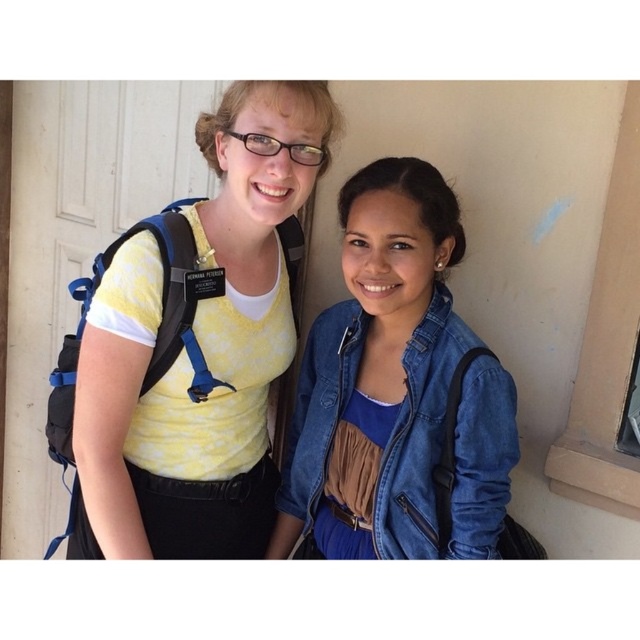
Question: Does yellow tie-dye t-shirt at left come in front of denim jacket at lower right?

Choices:
 (A) no
 (B) yes

Answer: (B)

Question: Which point is farther from the camera taking this photo?

Choices:
 (A) 264,128
 (B) 413,506

Answer: (B)

Question: Which object appears farthest from the camera in this image?

Choices:
 (A) denim jacket at lower right
 (B) yellow tie-dye t-shirt at left

Answer: (A)

Question: Is yellow tie-dye t-shirt at left below denim jacket at lower right?

Choices:
 (A) no
 (B) yes

Answer: (A)

Question: Where is yellow tie-dye t-shirt at left located in relation to denim jacket at lower right in the image?

Choices:
 (A) right
 (B) left

Answer: (B)